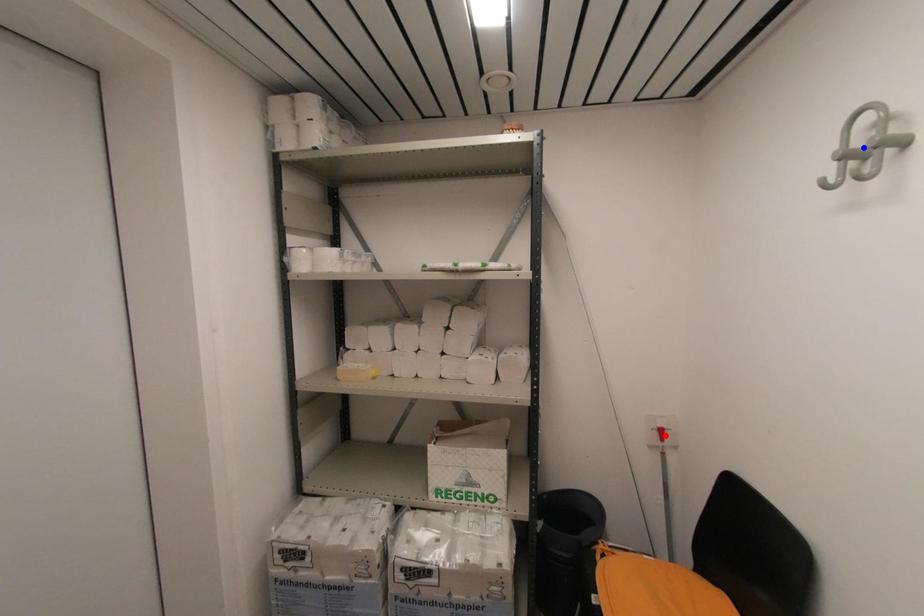
Question: Which of the two points in the image is closer to the camera?

Choices:
 (A) Blue point is closer.
 (B) Red point is closer.

Answer: (A)